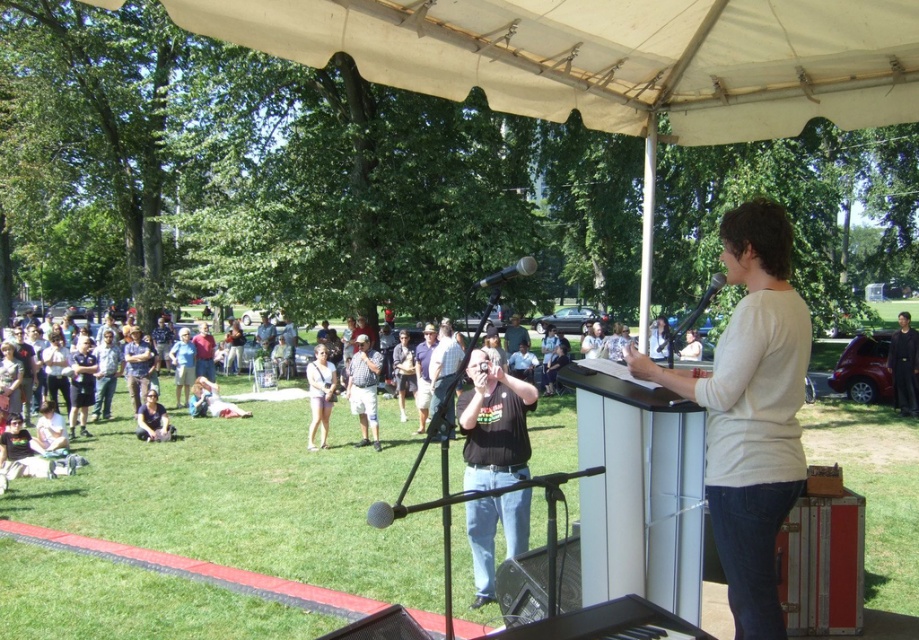
Question: Estimate the real-world distances between objects in this image. Which object is closer to the metallic silver speaker at lower center?

Choices:
 (A) white matte shirt at center
 (B) dark gray shirt at center
 (C) black t-shirt at center

Answer: (C)

Question: Does dark gray suit at lower right appear on the left side of light purple shorts at center?

Choices:
 (A) no
 (B) yes

Answer: (A)

Question: Which object is the farthest from the white fabric canopy at upper center?

Choices:
 (A) dark gray suit at lower right
 (B) white matte shirt at center

Answer: (A)

Question: Is white fabric canopy at upper center closer to the viewer compared to metallic silver microphone at center?

Choices:
 (A) yes
 (B) no

Answer: (A)

Question: Which of these objects is positioned closest to the white fabric canopy at upper center?

Choices:
 (A) metallic silver speaker at lower center
 (B) dark gray suit at lower right

Answer: (A)

Question: Is the position of metallic silver speaker at lower center more distant than that of dark gray suit at lower right?

Choices:
 (A) yes
 (B) no

Answer: (B)